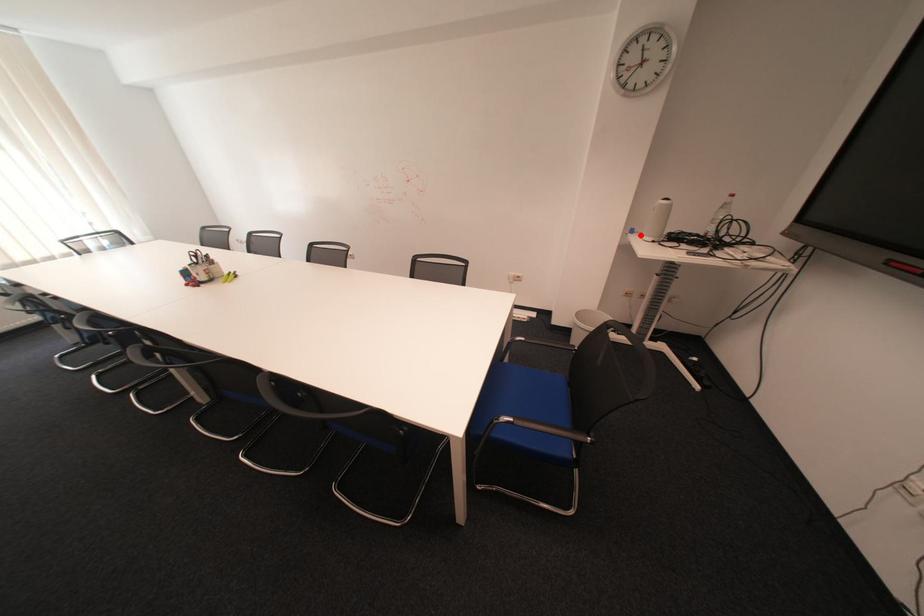
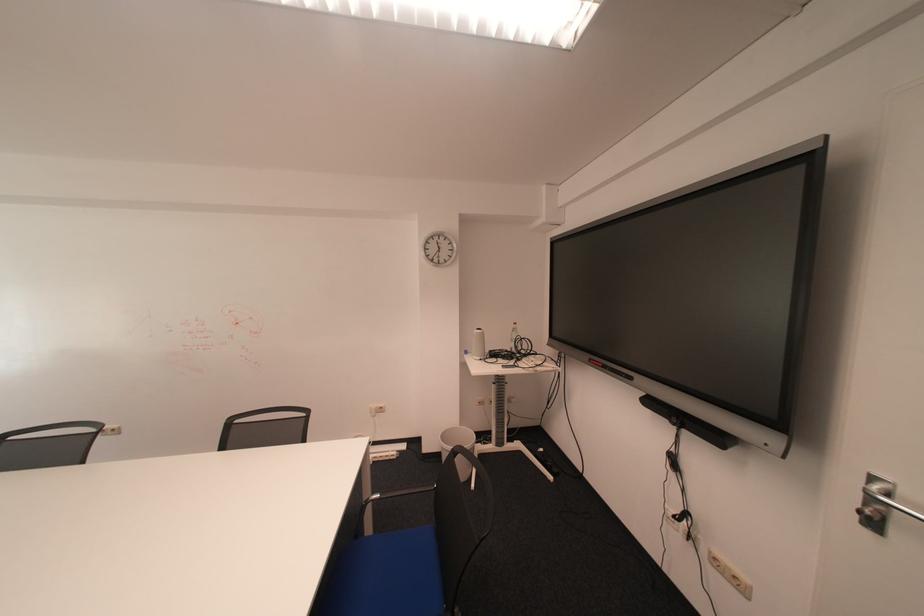
Question: I am providing you with two images of the same scene from different viewpoints. A red point is marked on the first image. At the location where the point appears in image 1, is it still visible in image 2?

Choices:
 (A) Yes
 (B) No

Answer: (A)